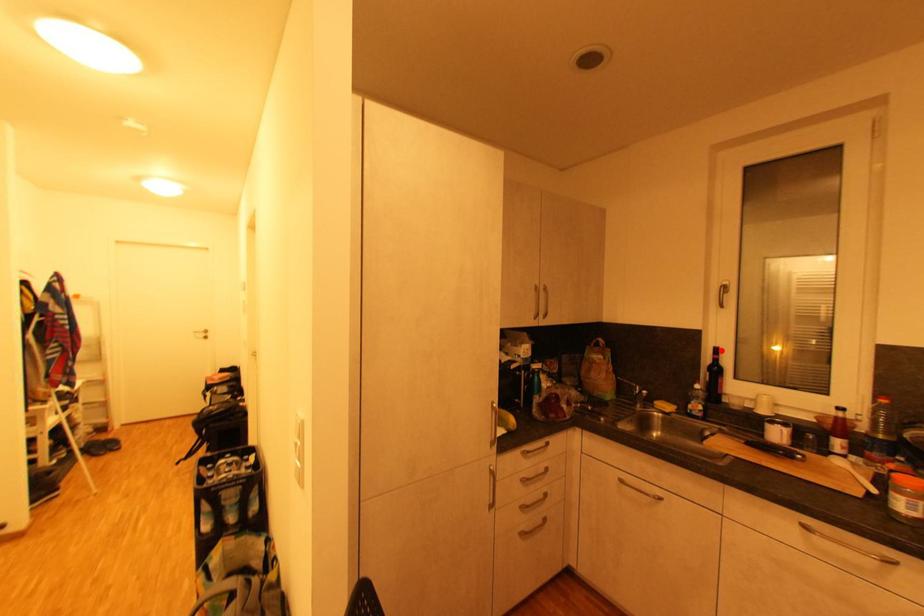
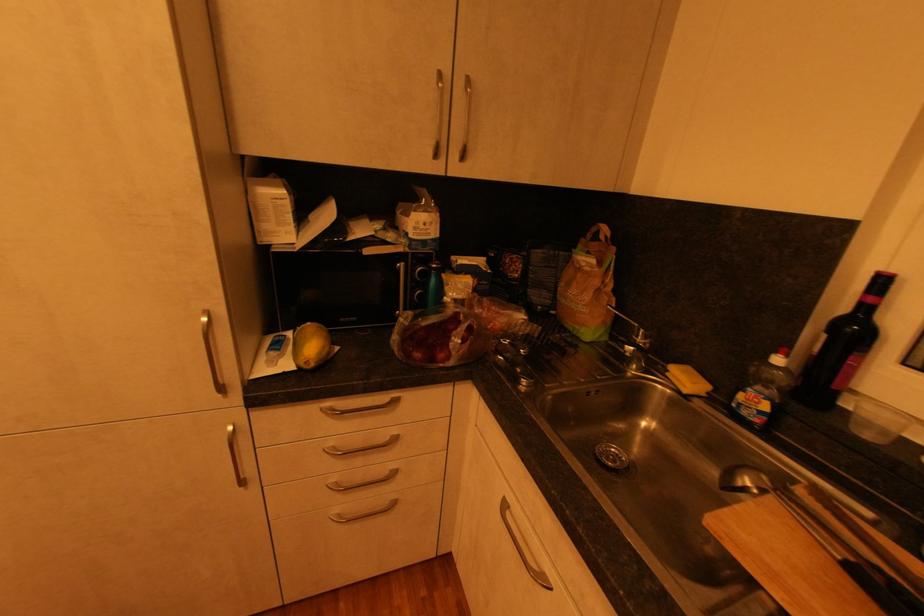
Locate, in the second image, the point that corresponds to the highlighted location in the first image.

(889, 282)